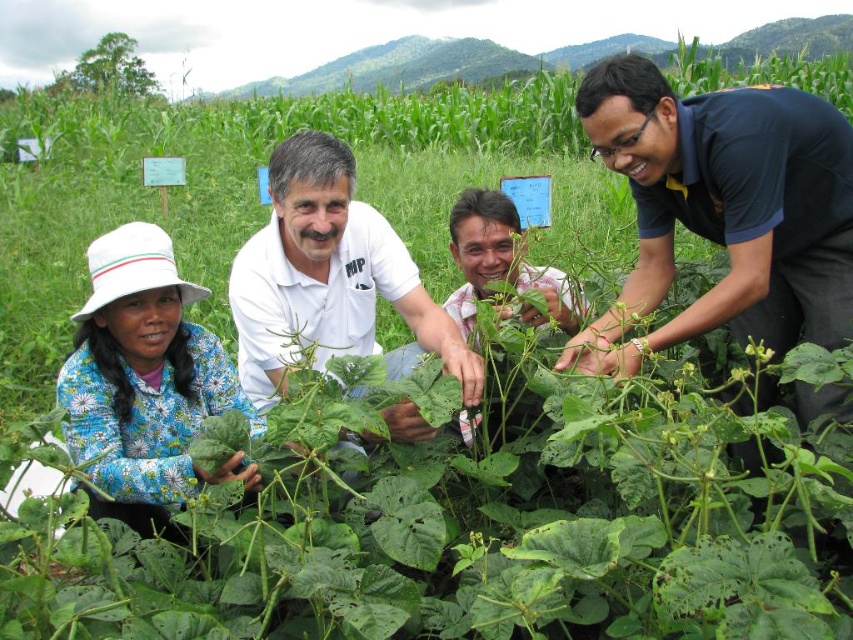
You are an observer looking at the scene. You notice two people wearing different clothing items. The dark blue shirt at center and the blue floral dress at lower left. Which clothing item is positioned higher in the image?

The dark blue shirt at center is positioned higher than the blue floral dress at lower left.

You are a photographer standing at the edge of the field and want to capture a photo that includes both the dark blue shirt at center and the white cotton shirt at center. The camera has a maximum focus range of 30 inches. Can you take the photo without moving closer?

The distance between the dark blue shirt at center and the white cotton shirt at center is 33.18 inches, which exceeds the camera maximum focus range of 30 inches. Therefore, you cannot take the photo without moving closer.